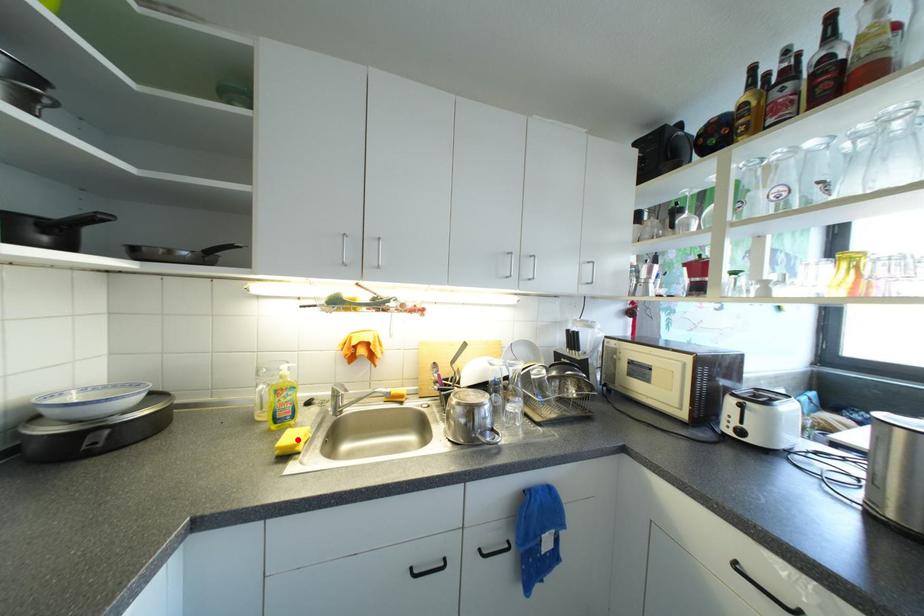
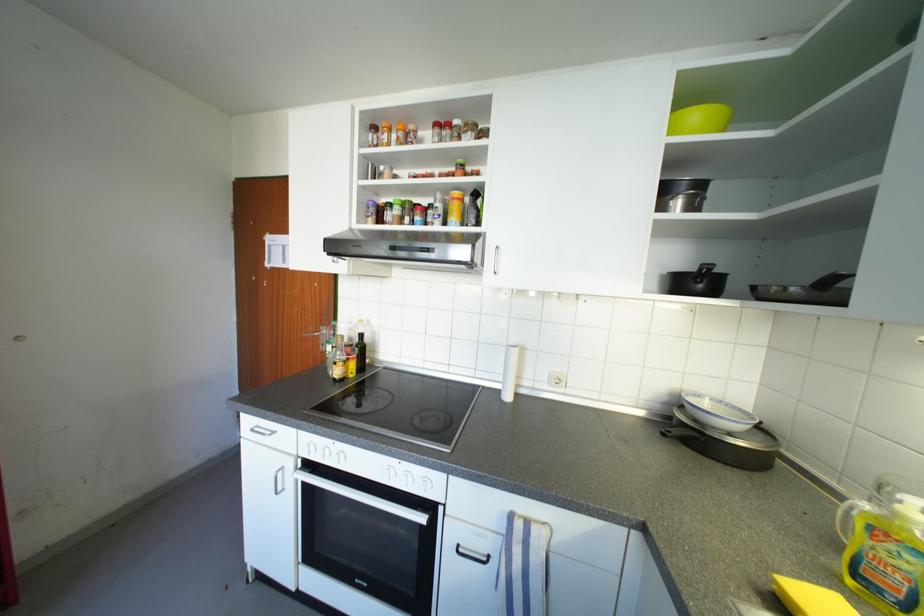
The point at the highlighted location is marked in the first image. Where is the corresponding point in the second image?

(824, 602)